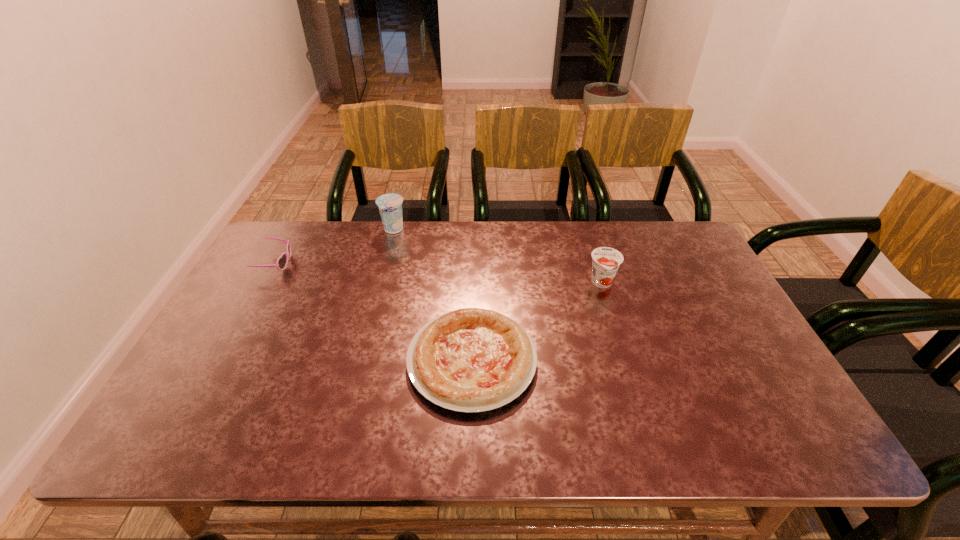
This screenshot has width=960, height=540. In order to click on vacant space that's between the second object from right to left and the farther yogurt in this screenshot , I will do tap(433, 295).

The image size is (960, 540). Find the location of `free spot between the left yogurt and the leftmost object`. free spot between the left yogurt and the leftmost object is located at coordinates (334, 246).

Choose which object is the nearest neighbor to the shorter yogurt. Please provide its 2D coordinates. Your answer should be formatted as a tuple, i.e. [(x, y)], where the tuple contains the x and y coordinates of a point satisfying the conditions above.

[(469, 360)]

Identify the location of the second closest object to the tallest object. (469, 360).

Find the location of a particular element. This screenshot has height=540, width=960. free space that satisfies the following two spatial constraints: 1. on the front side of the third object from left to right; 2. on the left side of the left yogurt is located at coordinates (360, 360).

You are a GUI agent. You are given a task and a screenshot of the screen. Output one action in this format:
    pyautogui.click(x=<x>, y=<y>)
    Task: Click on the vacant space that satisfies the following two spatial constraints: 1. on the front side of the nearer yogurt; 2. on the left side of the taller yogurt
    The height and width of the screenshot is (540, 960).
    Given the screenshot: What is the action you would take?
    pyautogui.click(x=380, y=284)

Where is `free space in the image that satisfies the following two spatial constraints: 1. on the back side of the shorter yogurt; 2. on the right side of the pizza`? This screenshot has width=960, height=540. free space in the image that satisfies the following two spatial constraints: 1. on the back side of the shorter yogurt; 2. on the right side of the pizza is located at coordinates (473, 284).

The image size is (960, 540). Find the location of `free space that satisfies the following two spatial constraints: 1. on the front-facing side of the nearest object; 2. on the right side of the leftmost object`. free space that satisfies the following two spatial constraints: 1. on the front-facing side of the nearest object; 2. on the right side of the leftmost object is located at coordinates (222, 360).

The height and width of the screenshot is (540, 960). Find the location of `free spot that satisfies the following two spatial constraints: 1. on the front-facing side of the leftmost object; 2. on the back side of the nearer yogurt`. free spot that satisfies the following two spatial constraints: 1. on the front-facing side of the leftmost object; 2. on the back side of the nearer yogurt is located at coordinates tap(265, 284).

In order to click on vacant space that satisfies the following two spatial constraints: 1. on the front-facing side of the sunglasses; 2. on the left side of the right yogurt in this screenshot , I will do `click(265, 284)`.